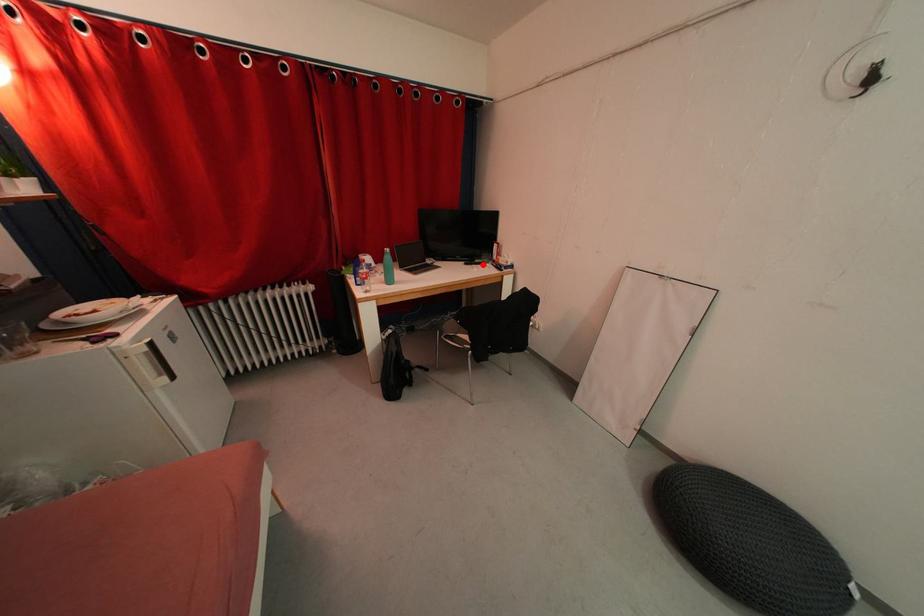
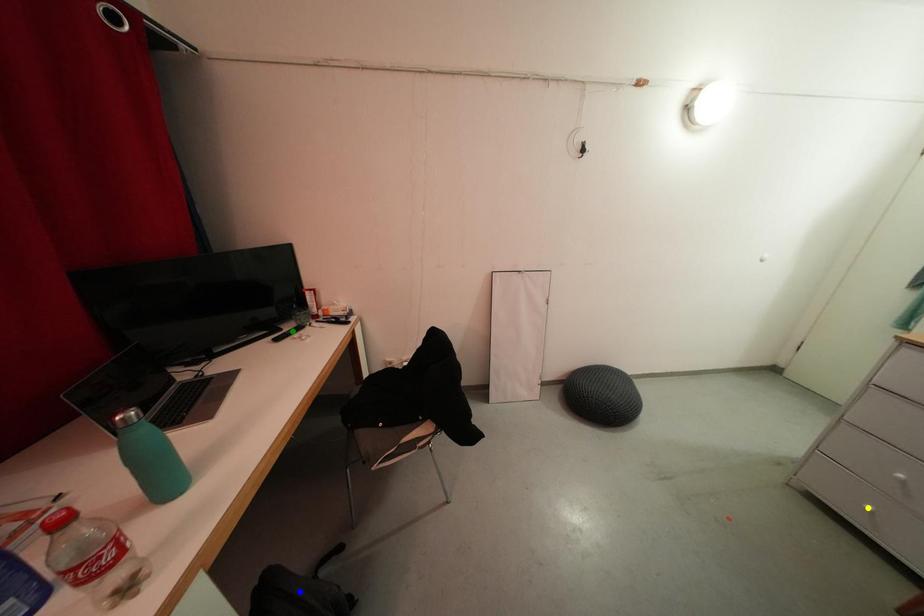
Question: I am providing you with two images of the same scene from different viewpoints. A red point is marked on the first image. You are given multiple points on the second image. Which spot in image 2 lines up with the point in image 1?

Choices:
 (A) yellow point
 (B) blue point
 (C) green point

Answer: (C)